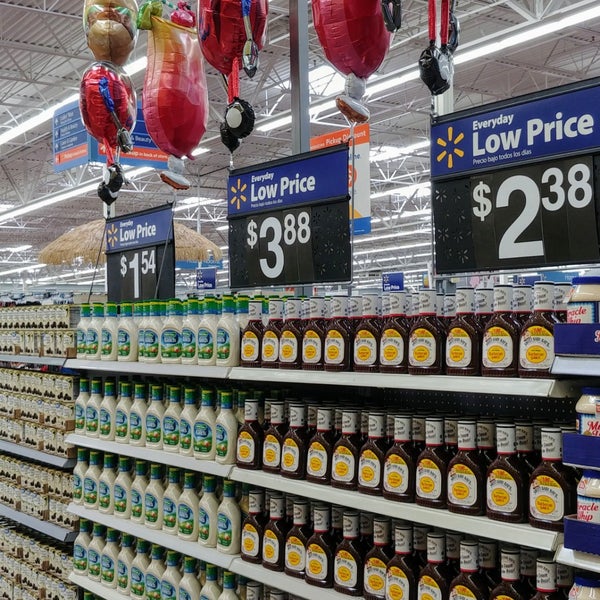
Where is `ceiling`? ceiling is located at coordinates (27, 86), (34, 57), (481, 79).